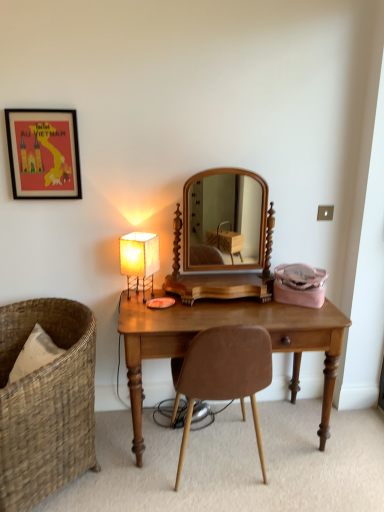
Question: Looking at the image, does brown leather chair at center, which is the second chair in left-to-right order, seem bigger or smaller compared to matte black picture frame at upper left?

Choices:
 (A) big
 (B) small

Answer: (A)

Question: Does point (208, 369) appear closer or farther from the camera than point (52, 113)?

Choices:
 (A) closer
 (B) farther

Answer: (A)

Question: Based on their relative distances, which object is nearer to the brown leather chair at center, which is the second chair in left-to-right order?

Choices:
 (A) woven brown chair at left, the 2th chair in the right-to-left sequence
 (B) matte black picture frame at upper left
 (C) white paper lampshade at left
 (D) wooden desk at center

Answer: (D)

Question: Which object is positioned closest to the brown leather chair at center, which ranks as the 1th chair in right-to-left order?

Choices:
 (A) woven brown chair at left, the 2th chair in the right-to-left sequence
 (B) matte black picture frame at upper left
 (C) white paper lampshade at left
 (D) wooden desk at center

Answer: (D)